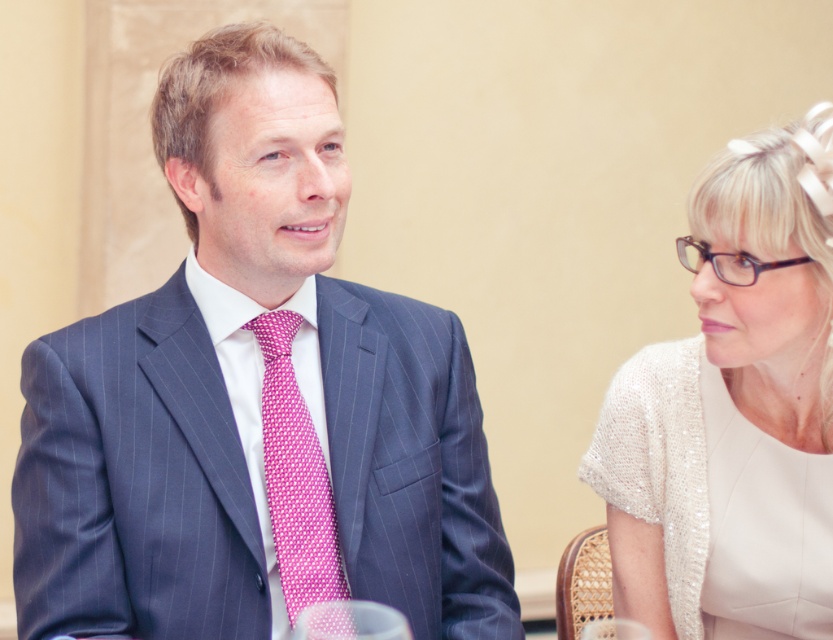
You are a photographer at a formal event. You want to capture a closeup shot of the pink dotted fabric tie at center while ensuring the sequined beige dress at right is still visible in the background. Given their sizes, will you need to adjust your camera angle to include both?

The sequined beige dress at right is wider than the pink dotted fabric tie at center. To include both in the shot, you might need to widen your camera angle or move closer to ensure the larger dress remains visible while keeping the smaller tie in focus.

You are a photographer at a wedding reception and need to position two guests for a photo. The guests are wearing a blue pinstripe suit at left and a sequined beige dress at right. Based on their current positions, which guest is positioned to the left side of the other?

The blue pinstripe suit at left is positioned to the left of the sequined beige dress at right.

You are a photographer at a formal event. You need to capture a photo of both the blue pinstripe suit at left and the sequined beige dress at right. Which one should you focus on first to ensure both are in frame?

You should focus on the blue pinstripe suit at left first because it is closer to the viewer than the sequined beige dress at right, allowing you to adjust the camera angle to include both in the frame.